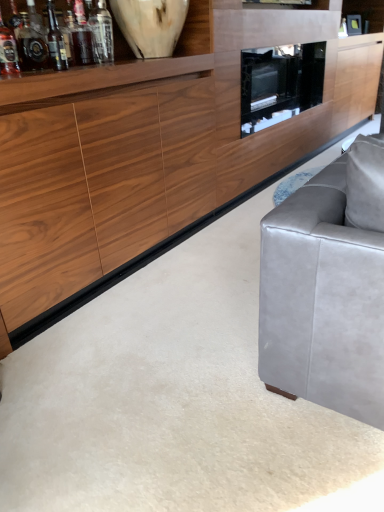
Question: From a real-world perspective, is matte glass bottle at left, which is counted as the 3th bottle, starting from the right, physically located above or below white marble vase at upper left?

Choices:
 (A) above
 (B) below

Answer: (B)

Question: Does point (24, 20) appear closer or farther from the camera than point (120, 13)?

Choices:
 (A) farther
 (B) closer

Answer: (B)

Question: Estimate the real-world distances between objects in this image. Which object is closer to the translucent glass wine bottle at upper left?

Choices:
 (A) wooden cabinet at center
 (B) translucent glass bottle at upper left, which is counted as the fourth bottle, starting from the right
 (C) matte glass bottle at left, which is counted as the 3th bottle, starting from the right
 (D) translucent glass bottle at upper left, acting as the 2th bottle starting from the right
 (E) clear glass bottle at upper left, the first bottle positioned from the right

Answer: (C)

Question: Which object is the farthest from the translucent glass wine bottle at upper left?

Choices:
 (A) translucent glass bottle at upper left, acting as the 2th bottle starting from the right
 (B) matte glass bottle at left, which is counted as the 3th bottle, starting from the right
 (C) wooden cabinet at center
 (D) clear glass bottle at upper left, the first bottle positioned from the right
 (E) translucent glass bottle at upper left, placed as the 1th bottle when sorted from left to right

Answer: (C)